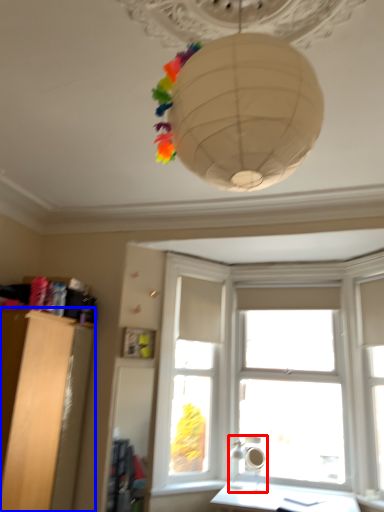
Question: Among these objects, which one is nearest to the camera, lamp (highlighted by a red box) or furniture (highlighted by a blue box)?

Choices:
 (A) lamp
 (B) furniture

Answer: (B)